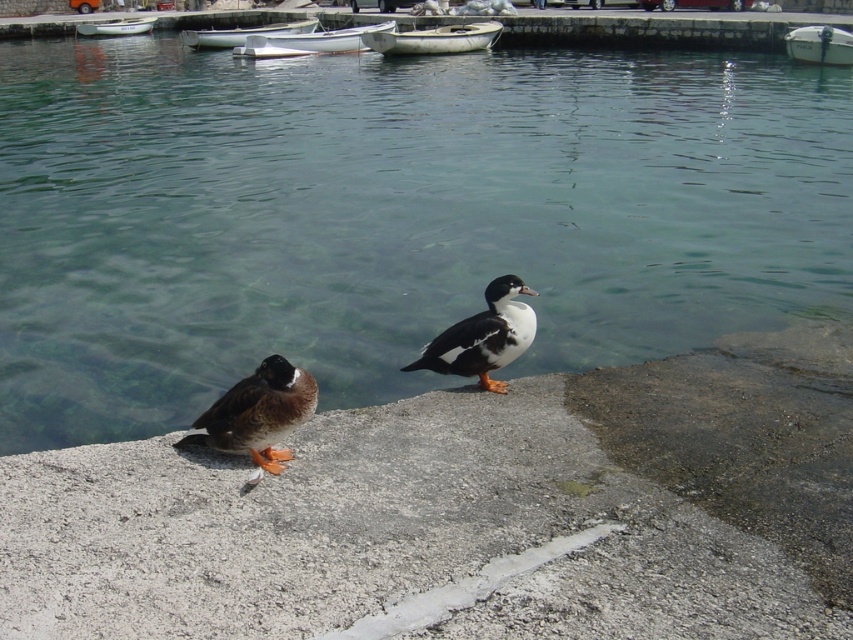
Image resolution: width=853 pixels, height=640 pixels. I want to click on white fiberglass boat at upper center, so point(242,33).

Is point (283, 22) farther from viewer compared to point (125, 24)?

No, it is in front of (125, 24).

Locate an element on the screen. The image size is (853, 640). white fiberglass boat at upper center is located at coordinates (242, 33).

Which is behind, point (698, 378) or point (837, 52)?

Positioned behind is point (837, 52).

Does gray concrete at center appear on the left side of white plastic boat at upper right?

Correct, you'll find gray concrete at center to the left of white plastic boat at upper right.

Between point (485, 596) and point (815, 26), which one is positioned behind?

The point (815, 26) is more distant.

Identify the location of gray concrete at center. The image size is (853, 640). (469, 513).

Between gray concrete at center and white plastic boat at center, which one has less height?

With less height is gray concrete at center.

Can you confirm if gray concrete at center is taller than white plastic boat at center?

Incorrect, gray concrete at center's height is not larger of white plastic boat at center's.

Which is in front, point (212, 516) or point (375, 26)?

Point (212, 516) is more forward.

The width and height of the screenshot is (853, 640). I want to click on gray concrete at center, so click(469, 513).